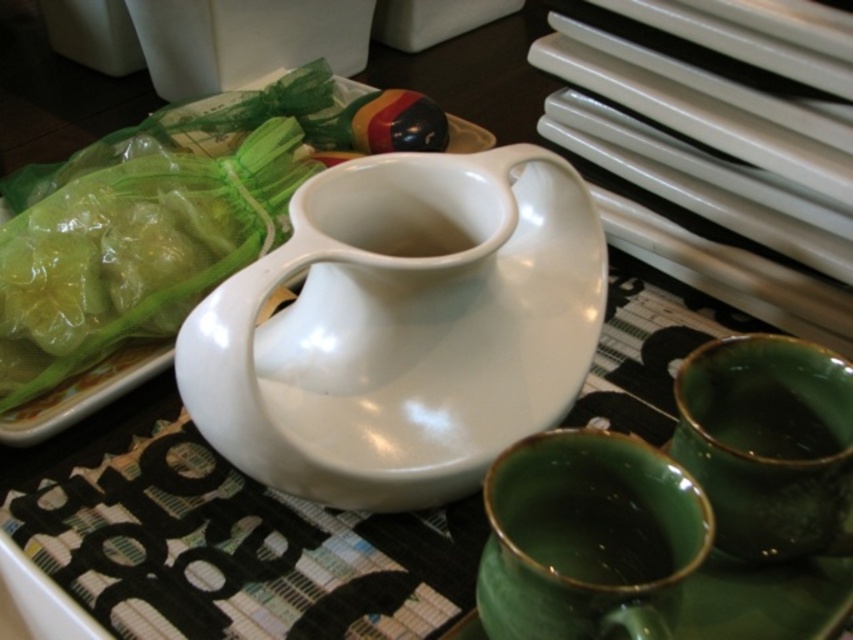
Question: Which is farther from the green glossy cups at lower right?

Choices:
 (A) white glossy bowl at center
 (B) white glossy jug at center

Answer: (A)

Question: Considering the relative positions of white glossy bowl at center and green glossy gravy boat at lower right in the image provided, where is white glossy bowl at center located with respect to green glossy gravy boat at lower right?

Choices:
 (A) right
 (B) left

Answer: (B)

Question: Based on their relative distances, which object is farther from the green glossy gravy boat at lower right?

Choices:
 (A) white glossy bowl at center
 (B) green glossy cups at lower right

Answer: (A)

Question: Is white glossy jug at center thinner than white glossy bowl at center?

Choices:
 (A) yes
 (B) no

Answer: (A)

Question: Is white glossy jug at center further to camera compared to green glossy gravy boat at lower right?

Choices:
 (A) no
 (B) yes

Answer: (B)

Question: Which point is farther from the camera taking this photo?

Choices:
 (A) (828, 516)
 (B) (253, 444)

Answer: (A)